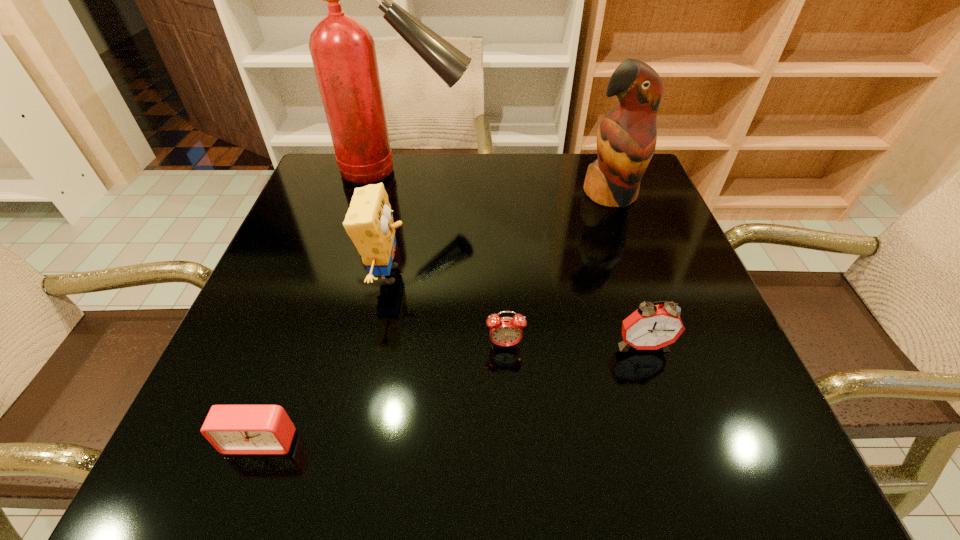
Choose which object is the fourth nearest neighbor to the third shortest object. Please provide its 2D coordinates. Your answer should be formatted as a tuple, i.e. [(x, y)], where the tuple contains the x and y coordinates of a point satisfying the conditions above.

[(232, 429)]

Identify the location of alarm clock identified as the closest to the sponge. The image size is (960, 540). (504, 331).

Point out which alarm clock is positioned as the third nearest to the fifth shortest object. Please provide its 2D coordinates. Your answer should be formatted as a tuple, i.e. [(x, y)], where the tuple contains the x and y coordinates of a point satisfying the conditions above.

[(232, 429)]

Find the location of a particular element. Image resolution: width=960 pixels, height=540 pixels. vacant position in the image that satisfies the following two spatial constraints: 1. on the face of the parrot; 2. on the face of the sponge is located at coordinates (639, 275).